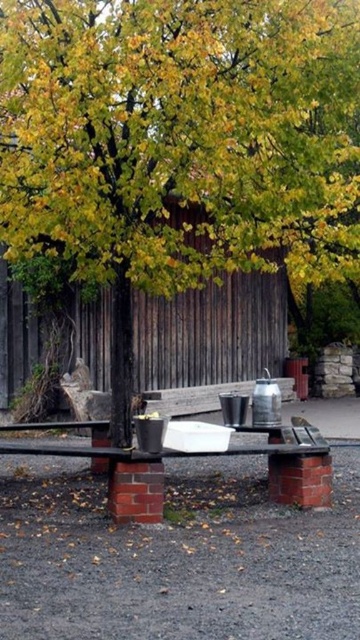
Question: Is wooden bench at center positioned at the back of smooth wooden bench at center?

Choices:
 (A) no
 (B) yes

Answer: (B)

Question: Estimate the real-world distances between objects in this image. Which object is farther from the green leafy tree at center?

Choices:
 (A) smooth wooden bench at center
 (B) wooden bench at center

Answer: (B)

Question: Is wooden bench at center closer to camera compared to smooth wooden bench at center?

Choices:
 (A) yes
 (B) no

Answer: (B)

Question: Which object is closer to the camera taking this photo?

Choices:
 (A) green leafy tree at center
 (B) smooth wooden bench at center
 (C) wooden bench at center

Answer: (A)

Question: Is green leafy tree at center to the right of wooden bench at center from the viewer's perspective?

Choices:
 (A) yes
 (B) no

Answer: (A)

Question: Based on their relative distances, which object is farther from the green leafy tree at center?

Choices:
 (A) smooth wooden bench at center
 (B) wooden bench at center

Answer: (B)